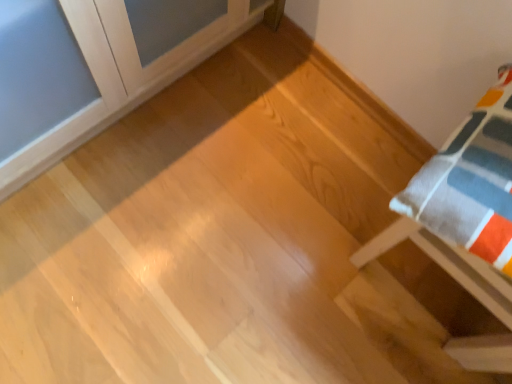
What do you see at coordinates (99, 67) in the screenshot? This screenshot has height=384, width=512. I see `light wood floor at upper left, positioned as the second furniture in right-to-left order` at bounding box center [99, 67].

Where is `light wood floor at upper left, the first furniture in the left-to-right sequence`? This screenshot has width=512, height=384. light wood floor at upper left, the first furniture in the left-to-right sequence is located at coordinates (99, 67).

The width and height of the screenshot is (512, 384). What are the coordinates of `white cotton pillow at right, the first furniture positioned from the right` in the screenshot? It's located at (464, 204).

Describe the element at coordinates (464, 204) in the screenshot. The image size is (512, 384). I see `white cotton pillow at right, the first furniture positioned from the right` at that location.

This screenshot has width=512, height=384. What are the coordinates of `light wood floor at upper left, positioned as the second furniture in right-to-left order` in the screenshot? It's located at (99, 67).

Which object is positioned more to the left, white cotton pillow at right, which ranks as the second furniture in left-to-right order, or light wood floor at upper left, positioned as the second furniture in right-to-left order?

light wood floor at upper left, positioned as the second furniture in right-to-left order.

From the picture: Relative to light wood floor at upper left, positioned as the second furniture in right-to-left order, is white cotton pillow at right, the first furniture positioned from the right, in front or behind?

white cotton pillow at right, the first furniture positioned from the right, is behind light wood floor at upper left, positioned as the second furniture in right-to-left order.

Does point (496, 298) lie behind point (75, 29)?

No, (496, 298) is closer to viewer.

From the image's perspective, does white cotton pillow at right, which ranks as the second furniture in left-to-right order, appear higher than light wood floor at upper left, positioned as the second furniture in right-to-left order?

No, from the image's perspective, white cotton pillow at right, which ranks as the second furniture in left-to-right order, is not over light wood floor at upper left, positioned as the second furniture in right-to-left order.

From a real-world perspective, is white cotton pillow at right, which ranks as the second furniture in left-to-right order, on light wood floor at upper left, the first furniture in the left-to-right sequence?

Actually, white cotton pillow at right, which ranks as the second furniture in left-to-right order, is physically below light wood floor at upper left, the first furniture in the left-to-right sequence, in the real world.

Based on the photo, can you confirm if white cotton pillow at right, which ranks as the second furniture in left-to-right order, is wider than light wood floor at upper left, positioned as the second furniture in right-to-left order?

In fact, white cotton pillow at right, which ranks as the second furniture in left-to-right order, might be narrower than light wood floor at upper left, positioned as the second furniture in right-to-left order.

Is white cotton pillow at right, the first furniture positioned from the right, shorter than light wood floor at upper left, the first furniture in the left-to-right sequence?

Indeed, white cotton pillow at right, the first furniture positioned from the right, has a lesser height compared to light wood floor at upper left, the first furniture in the left-to-right sequence.

Considering the sizes of objects white cotton pillow at right, the first furniture positioned from the right, and light wood floor at upper left, positioned as the second furniture in right-to-left order, in the image provided, who is smaller, white cotton pillow at right, the first furniture positioned from the right, or light wood floor at upper left, positioned as the second furniture in right-to-left order,?

white cotton pillow at right, the first furniture positioned from the right, is smaller.

Which is correct: white cotton pillow at right, which ranks as the second furniture in left-to-right order, is inside light wood floor at upper left, positioned as the second furniture in right-to-left order, or outside of it?

white cotton pillow at right, which ranks as the second furniture in left-to-right order, cannot be found inside light wood floor at upper left, positioned as the second furniture in right-to-left order.

Is the surface of white cotton pillow at right, which ranks as the second furniture in left-to-right order, in direct contact with light wood floor at upper left, positioned as the second furniture in right-to-left order?

white cotton pillow at right, which ranks as the second furniture in left-to-right order, and light wood floor at upper left, positioned as the second furniture in right-to-left order, are clearly separated.

Based on the photo, is white cotton pillow at right, the first furniture positioned from the right, oriented towards light wood floor at upper left, the first furniture in the left-to-right sequence?

No, white cotton pillow at right, the first furniture positioned from the right, is not facing towards light wood floor at upper left, the first furniture in the left-to-right sequence.

What's the angular difference between white cotton pillow at right, the first furniture positioned from the right, and light wood floor at upper left, positioned as the second furniture in right-to-left order,'s facing directions?

white cotton pillow at right, the first furniture positioned from the right, and light wood floor at upper left, positioned as the second furniture in right-to-left order, are facing 87.8 degrees away from each other.

This screenshot has height=384, width=512. Find the location of `furniture below the light wood floor at upper left, the first furniture in the left-to-right sequence (from a real-world perspective)`. furniture below the light wood floor at upper left, the first furniture in the left-to-right sequence (from a real-world perspective) is located at coordinates (464, 204).

Which object is positioned more to the right, light wood floor at upper left, positioned as the second furniture in right-to-left order, or white cotton pillow at right, which ranks as the second furniture in left-to-right order?

Positioned to the right is white cotton pillow at right, which ranks as the second furniture in left-to-right order.

Considering the positions of objects light wood floor at upper left, positioned as the second furniture in right-to-left order, and white cotton pillow at right, which ranks as the second furniture in left-to-right order, in the image provided, who is in front, light wood floor at upper left, positioned as the second furniture in right-to-left order, or white cotton pillow at right, which ranks as the second furniture in left-to-right order,?

light wood floor at upper left, positioned as the second furniture in right-to-left order, is more forward.

Which is behind, point (36, 137) or point (482, 253)?

Point (36, 137)

From the image's perspective, which one is positioned higher, light wood floor at upper left, the first furniture in the left-to-right sequence, or white cotton pillow at right, the first furniture positioned from the right?

light wood floor at upper left, the first furniture in the left-to-right sequence, is shown above in the image.

From a real-world perspective, is light wood floor at upper left, the first furniture in the left-to-right sequence, positioned above or below white cotton pillow at right, which ranks as the second furniture in left-to-right order?

light wood floor at upper left, the first furniture in the left-to-right sequence, is above white cotton pillow at right, which ranks as the second furniture in left-to-right order.

Is light wood floor at upper left, the first furniture in the left-to-right sequence, wider or thinner than white cotton pillow at right, the first furniture positioned from the right?

light wood floor at upper left, the first furniture in the left-to-right sequence, is wider than white cotton pillow at right, the first furniture positioned from the right.

Which of these two, light wood floor at upper left, positioned as the second furniture in right-to-left order, or white cotton pillow at right, which ranks as the second furniture in left-to-right order, stands shorter?

white cotton pillow at right, which ranks as the second furniture in left-to-right order.

In the scene shown: Based on their sizes in the image, would you say light wood floor at upper left, positioned as the second furniture in right-to-left order, is bigger or smaller than white cotton pillow at right, which ranks as the second furniture in left-to-right order?

Clearly, light wood floor at upper left, positioned as the second furniture in right-to-left order, is larger in size than white cotton pillow at right, which ranks as the second furniture in left-to-right order.

Is light wood floor at upper left, the first furniture in the left-to-right sequence, outside of white cotton pillow at right, the first furniture positioned from the right?

Yes, light wood floor at upper left, the first furniture in the left-to-right sequence, is outside of white cotton pillow at right, the first furniture positioned from the right.

Consider the image. Is light wood floor at upper left, the first furniture in the left-to-right sequence, positioned far away from white cotton pillow at right, which ranks as the second furniture in left-to-right order?

No, light wood floor at upper left, the first furniture in the left-to-right sequence, is not far from white cotton pillow at right, which ranks as the second furniture in left-to-right order.

Is light wood floor at upper left, positioned as the second furniture in right-to-left order, aimed at white cotton pillow at right, which ranks as the second furniture in left-to-right order?

Yes, light wood floor at upper left, positioned as the second furniture in right-to-left order, is aimed at white cotton pillow at right, which ranks as the second furniture in left-to-right order.

How many degrees apart are the facing directions of light wood floor at upper left, the first furniture in the left-to-right sequence, and white cotton pillow at right, which ranks as the second furniture in left-to-right order?

The angular difference between light wood floor at upper left, the first furniture in the left-to-right sequence, and white cotton pillow at right, which ranks as the second furniture in left-to-right order, is 87.8 degrees.

Measure the distance between light wood floor at upper left, positioned as the second furniture in right-to-left order, and white cotton pillow at right, which ranks as the second furniture in left-to-right order.

The distance of light wood floor at upper left, positioned as the second furniture in right-to-left order, from white cotton pillow at right, which ranks as the second furniture in left-to-right order, is 29.88 inches.

This screenshot has height=384, width=512. What are the coordinates of `furniture below the light wood floor at upper left, the first furniture in the left-to-right sequence (from a real-world perspective)` in the screenshot? It's located at (464, 204).

This screenshot has height=384, width=512. Identify the location of furniture in front of the white cotton pillow at right, which ranks as the second furniture in left-to-right order. (99, 67).

This screenshot has height=384, width=512. I want to click on furniture below the light wood floor at upper left, positioned as the second furniture in right-to-left order (from the image's perspective), so click(x=464, y=204).